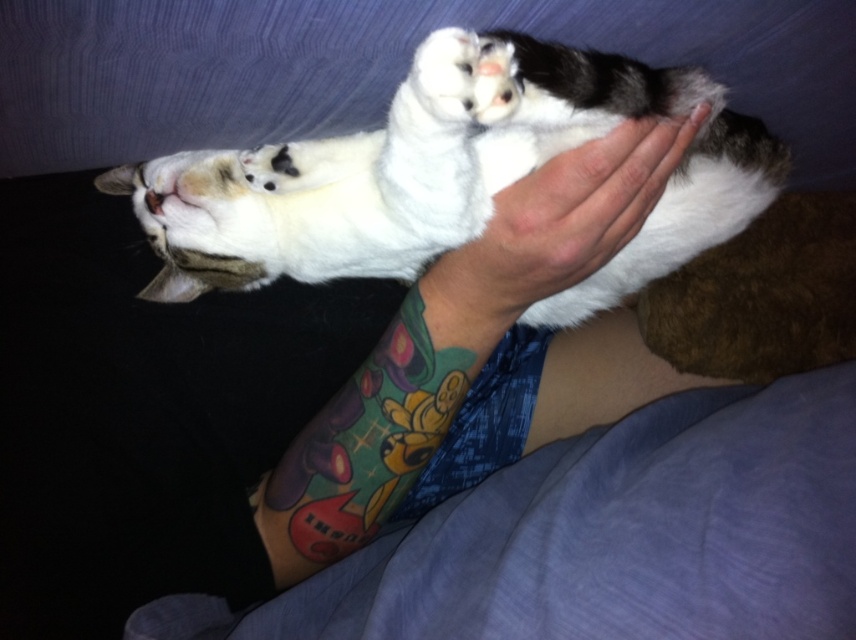
Which is below, multicolored tattooed arm at center or smooth skin hand at center?

multicolored tattooed arm at center

Does multicolored tattooed arm at center appear on the left side of smooth skin hand at center?

Indeed, multicolored tattooed arm at center is positioned on the left side of smooth skin hand at center.

Is point (461, 349) in front of point (556, 216)?

No, it is not.

Image resolution: width=856 pixels, height=640 pixels. I want to click on multicolored tattooed arm at center, so click(x=456, y=340).

Is white soft fur cat at center smaller than smooth skin hand at center?

Incorrect, white soft fur cat at center is not smaller in size than smooth skin hand at center.

Is point (693, 212) less distant than point (526, 220)?

No, (693, 212) is further to viewer.

Where is `white soft fur cat at center`? white soft fur cat at center is located at coordinates (449, 177).

Can you confirm if white soft fur cat at center is smaller than multicolored tattooed arm at center?

No, white soft fur cat at center is not smaller than multicolored tattooed arm at center.

Measure the distance between white soft fur cat at center and multicolored tattooed arm at center.

white soft fur cat at center is 4.52 inches from multicolored tattooed arm at center.

Does point (717, 208) lie in front of point (413, 362)?

Yes, it is.

This screenshot has height=640, width=856. What are the coordinates of `white soft fur cat at center` in the screenshot? It's located at pyautogui.click(x=449, y=177).